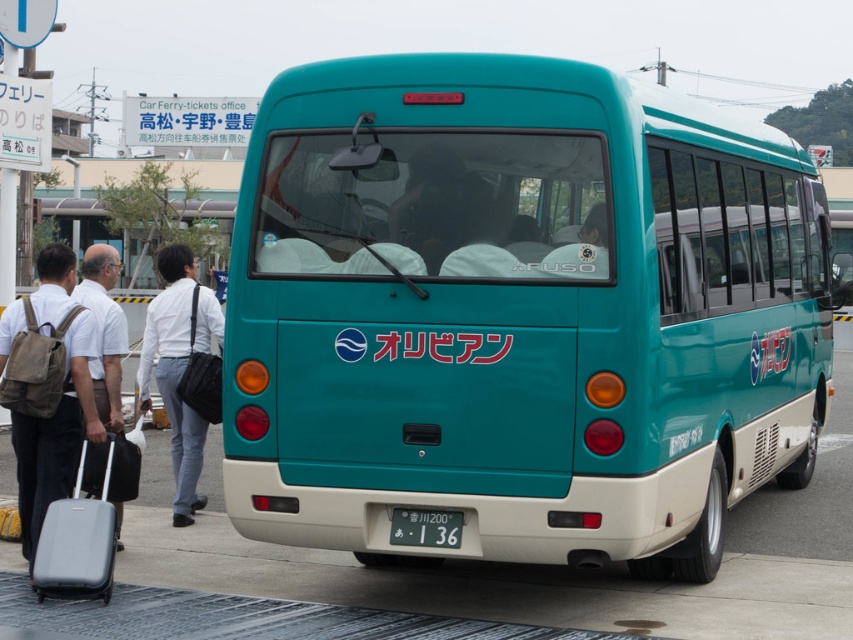
You are a photographer standing at the bus terminal. You want to take a photo of the teal matte bus at center and the white plastic license plate at center. Which object should you focus on first if you want to capture both in a single shot without moving the camera?

The teal matte bus at center is much taller than the white plastic license plate at center, so you should focus on the taller object first to ensure both are in frame.